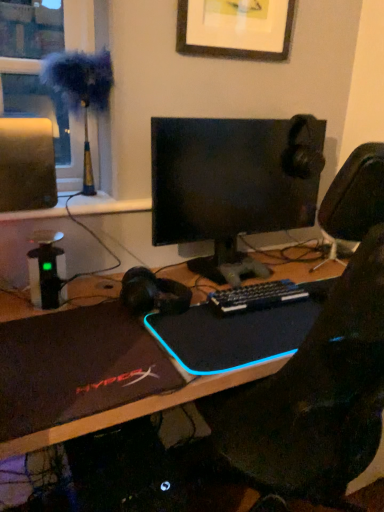
Question: Does fuzzy fabric at left have a lesser height compared to wooden picture frame at upper center?

Choices:
 (A) no
 (B) yes

Answer: (A)

Question: Does fuzzy fabric at left have a larger size compared to wooden picture frame at upper center?

Choices:
 (A) yes
 (B) no

Answer: (A)

Question: Does fuzzy fabric at left have a greater width compared to wooden picture frame at upper center?

Choices:
 (A) no
 (B) yes

Answer: (B)

Question: Considering the relative positions of fuzzy fabric at left and wooden picture frame at upper center in the image provided, is fuzzy fabric at left to the right of wooden picture frame at upper center from the viewer's perspective?

Choices:
 (A) yes
 (B) no

Answer: (B)

Question: From the image's perspective, does fuzzy fabric at left appear lower than wooden picture frame at upper center?

Choices:
 (A) no
 (B) yes

Answer: (B)

Question: Does point 190,309 appear closer or farther from the camera than point 173,242?

Choices:
 (A) farther
 (B) closer

Answer: (B)

Question: Considering the relative positions of black matte laptop at center, placed as the second laptop when sorted from left to right, and black glossy monitor at center in the image provided, is black matte laptop at center, placed as the second laptop when sorted from left to right, to the left or to the right of black glossy monitor at center?

Choices:
 (A) left
 (B) right

Answer: (B)

Question: From the image's perspective, is black matte laptop at center, placed as the second laptop when sorted from left to right, positioned above or below black glossy monitor at center?

Choices:
 (A) below
 (B) above

Answer: (A)

Question: Looking at their shapes, would you say black matte laptop at center, arranged as the first laptop when viewed from the right, is wider or thinner than black glossy monitor at center?

Choices:
 (A) thin
 (B) wide

Answer: (B)

Question: Considering the positions of fuzzy fabric at left and black plastic keyboard at center in the image, is fuzzy fabric at left taller or shorter than black plastic keyboard at center?

Choices:
 (A) tall
 (B) short

Answer: (A)

Question: From a real-world perspective, is fuzzy fabric at left positioned above or below black plastic keyboard at center?

Choices:
 (A) above
 (B) below

Answer: (A)

Question: Based on their positions, is fuzzy fabric at left located to the left or right of black plastic keyboard at center?

Choices:
 (A) right
 (B) left

Answer: (B)

Question: From the image's perspective, is fuzzy fabric at left above or below black plastic keyboard at center?

Choices:
 (A) below
 (B) above

Answer: (B)

Question: From a real-world perspective, is black matte laptop at center, arranged as the first laptop when viewed from the right, physically located above or below wooden picture frame at upper center?

Choices:
 (A) below
 (B) above

Answer: (A)

Question: Looking at their shapes, would you say black matte laptop at center, placed as the second laptop when sorted from left to right, is wider or thinner than wooden picture frame at upper center?

Choices:
 (A) thin
 (B) wide

Answer: (B)